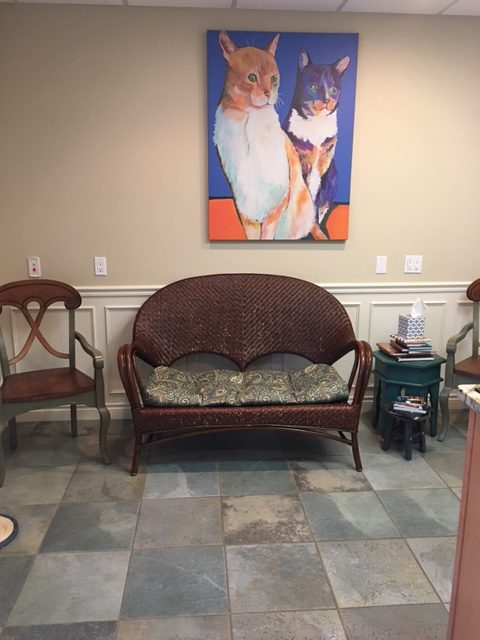
Where is `wainscoting`? Image resolution: width=480 pixels, height=640 pixels. wainscoting is located at coordinates (103, 317), (383, 305).